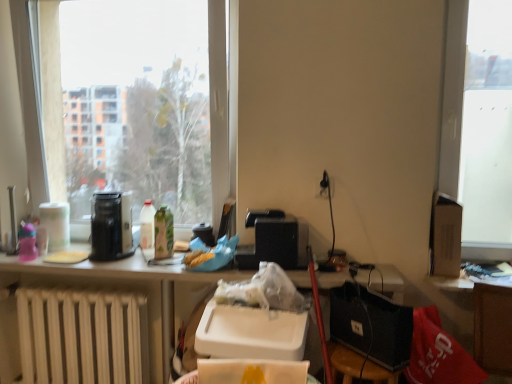
Question: Is white matte radiator at lower left to the right of green matte bottle at center, the first bottle viewed from the right, from the viewer's perspective?

Choices:
 (A) no
 (B) yes

Answer: (A)

Question: Does white matte radiator at lower left have a larger size compared to green matte bottle at center, which appears as the 2th bottle when viewed from the left?

Choices:
 (A) no
 (B) yes

Answer: (B)

Question: Is white matte radiator at lower left positioned behind green matte bottle at center, the first bottle viewed from the right?

Choices:
 (A) yes
 (B) no

Answer: (B)

Question: Considering the relative positions of white matte radiator at lower left and green matte bottle at center, the first bottle viewed from the right, in the image provided, is white matte radiator at lower left to the left of green matte bottle at center, the first bottle viewed from the right, from the viewer's perspective?

Choices:
 (A) yes
 (B) no

Answer: (A)

Question: Does white matte radiator at lower left have a lesser width compared to green matte bottle at center, which appears as the 2th bottle when viewed from the left?

Choices:
 (A) yes
 (B) no

Answer: (B)

Question: In terms of width, does black plastic speaker at center look wider or thinner when compared to white glossy bottle at center, placed as the second bottle when sorted from right to left?

Choices:
 (A) thin
 (B) wide

Answer: (B)

Question: From a real-world perspective, relative to white glossy bottle at center, placed as the second bottle when sorted from right to left, is black plastic speaker at center vertically above or below?

Choices:
 (A) below
 (B) above

Answer: (A)

Question: Does point tap(274, 218) appear closer or farther from the camera than point tap(139, 225)?

Choices:
 (A) farther
 (B) closer

Answer: (B)

Question: Looking at the image, does black plastic speaker at center seem bigger or smaller compared to white glossy bottle at center, positioned as the 1th bottle in left-to-right order?

Choices:
 (A) small
 (B) big

Answer: (B)

Question: Looking at their shapes, would you say transparent glass window at upper left is wider or thinner than matte black coffee maker at center, which is counted as the second appliance, starting from the left?

Choices:
 (A) wide
 (B) thin

Answer: (A)

Question: From the image's perspective, is transparent glass window at upper left located above or below matte black coffee maker at center, which is the first appliance in right-to-left order?

Choices:
 (A) above
 (B) below

Answer: (A)

Question: Is point (224, 44) closer or farther from the camera than point (194, 228)?

Choices:
 (A) closer
 (B) farther

Answer: (A)

Question: From a real-world perspective, is transparent glass window at upper left above or below matte black coffee maker at center, which is counted as the second appliance, starting from the left?

Choices:
 (A) below
 (B) above

Answer: (B)

Question: Is white glossy bottle at center, placed as the second bottle when sorted from right to left, to the left or to the right of white matte radiator at lower left in the image?

Choices:
 (A) left
 (B) right

Answer: (B)

Question: Is white glossy bottle at center, placed as the second bottle when sorted from right to left, bigger or smaller than white matte radiator at lower left?

Choices:
 (A) small
 (B) big

Answer: (A)